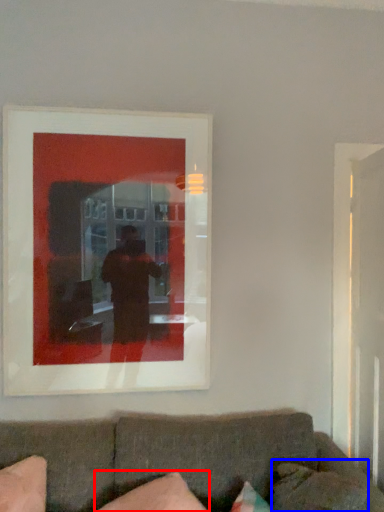
Question: Which object is closer to the camera taking this photo, pillow (highlighted by a red box) or pillow (highlighted by a blue box)?

Choices:
 (A) pillow
 (B) pillow

Answer: (A)